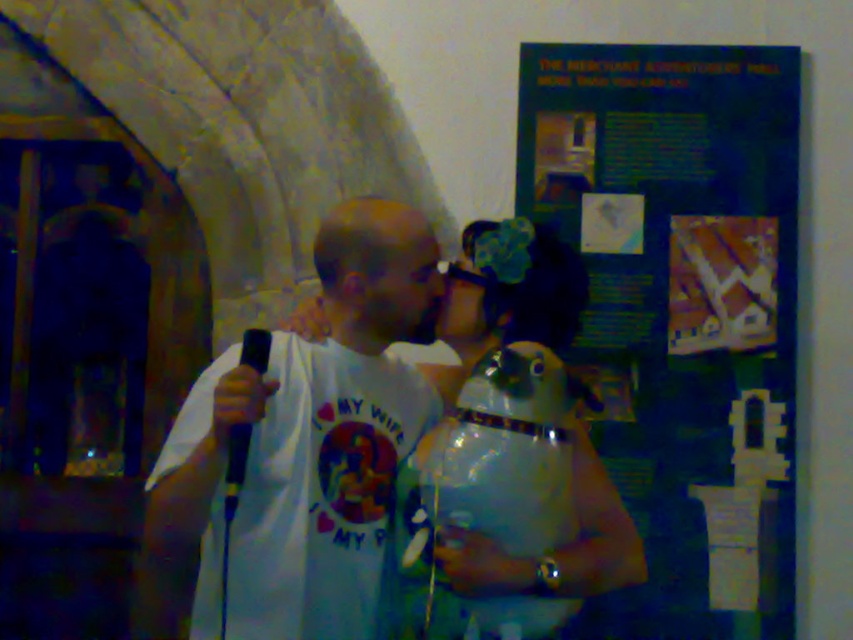
Measure the distance between point (219, 417) and camera.

A distance of 5.58 feet exists between point (219, 417) and camera.

Which of these two, white t-shirt at center or transparent plastic bag at center, stands shorter?

transparent plastic bag at center

Does point (438, 400) come behind point (590, 529)?

Yes, point (438, 400) is behind point (590, 529).

This screenshot has width=853, height=640. In order to click on white t-shirt at center in this screenshot , I will do `click(309, 442)`.